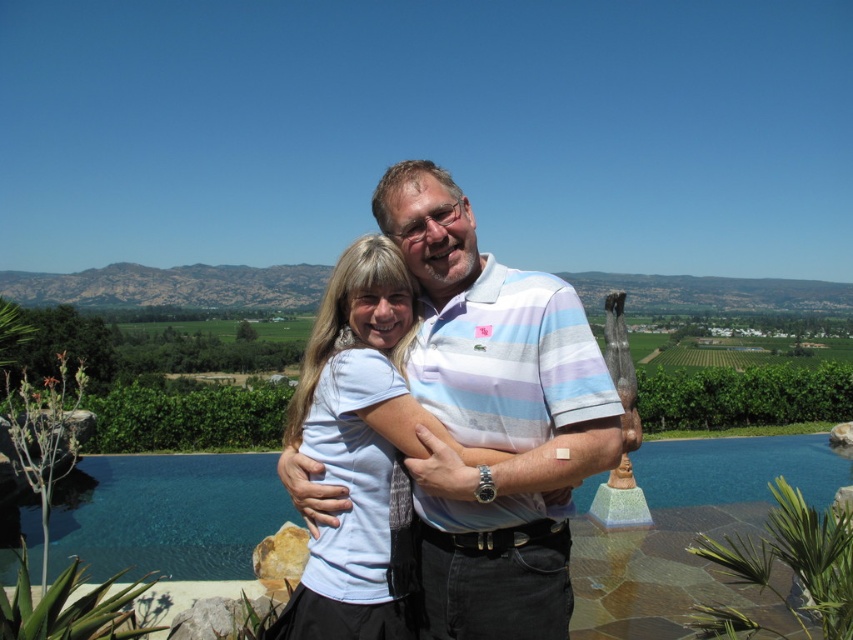
Is point (433, 269) positioned in front of point (338, 465)?

No.

Can you confirm if white cotton shirt at center is taller than white matte shirt at center?

Yes, white cotton shirt at center is taller than white matte shirt at center.

The image size is (853, 640). Identify the location of white cotton shirt at center. (494, 417).